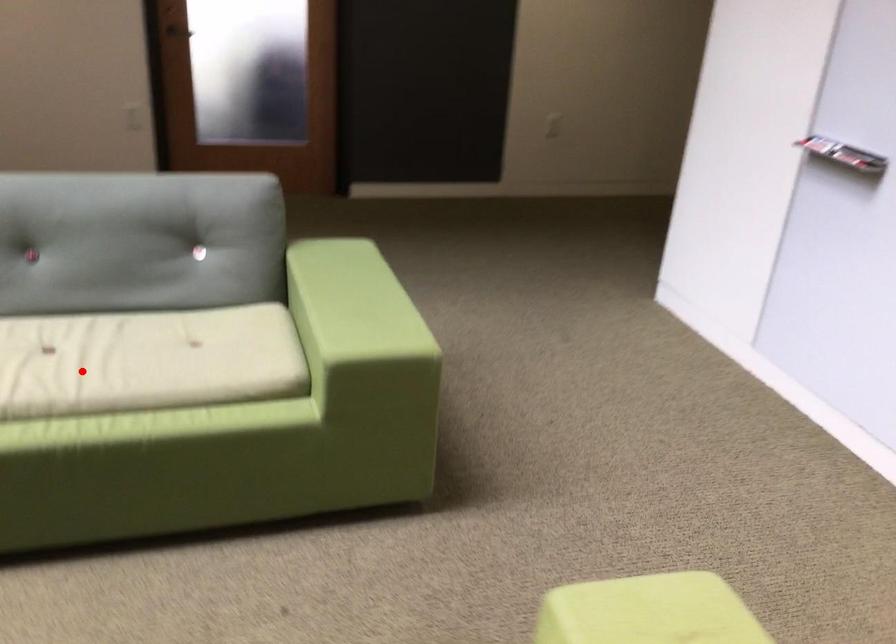
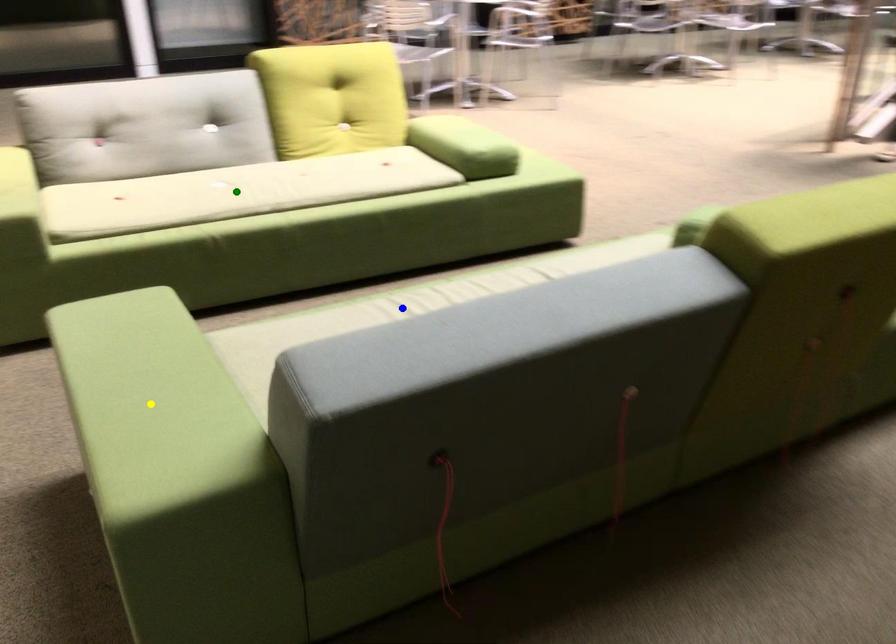
Question: I am providing you with two images of the same scene from different viewpoints. A red point is marked on the first image. You are given multiple points on the second image. Which mark in image 2 goes with the point in image 1?

Choices:
 (A) green point
 (B) yellow point
 (C) blue point

Answer: (C)